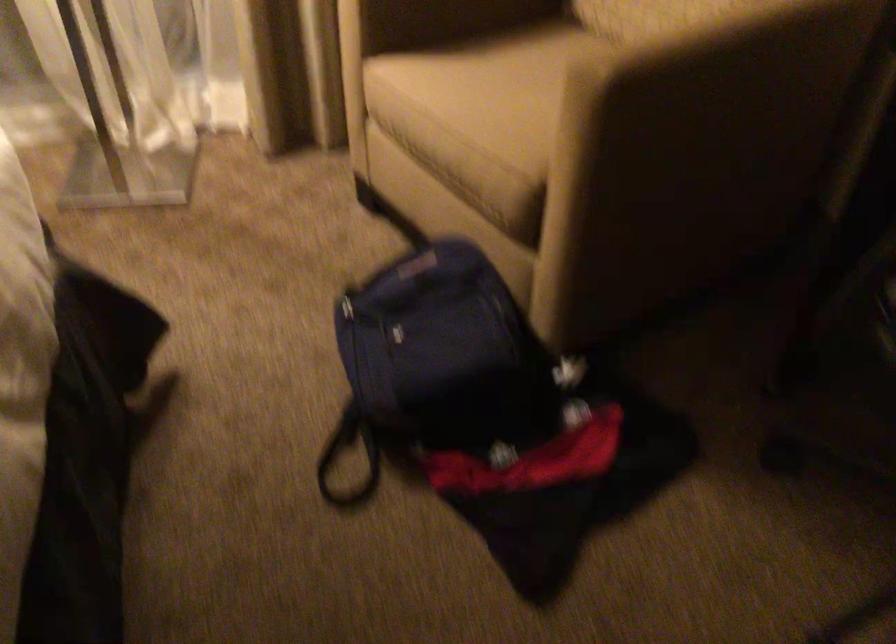
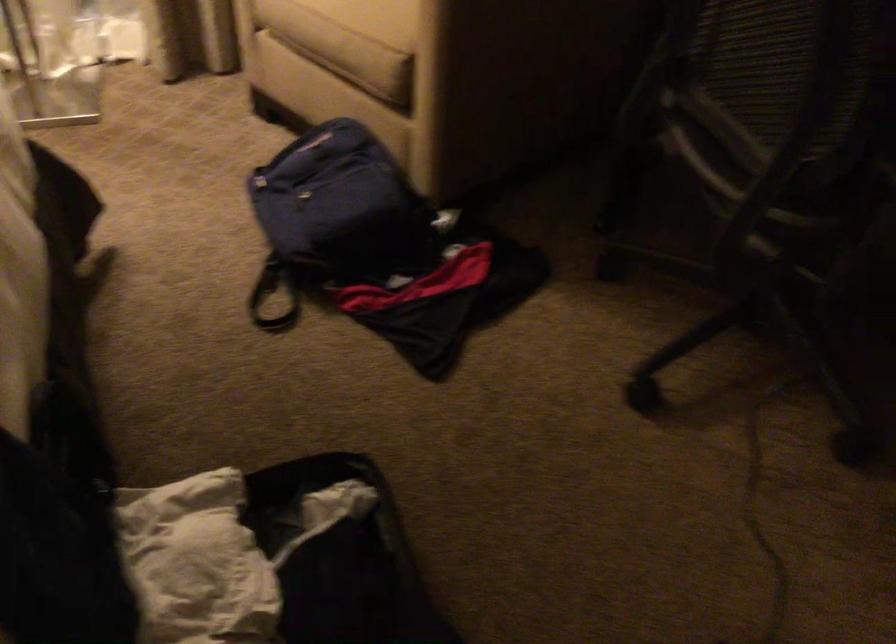
Question: The camera is either moving clockwise (left) or counter-clockwise (right) around the object. The first image is from the beginning of the video and the second image is from the end. Is the camera moving left or right when shooting the video?

Choices:
 (A) Left
 (B) Right

Answer: (A)